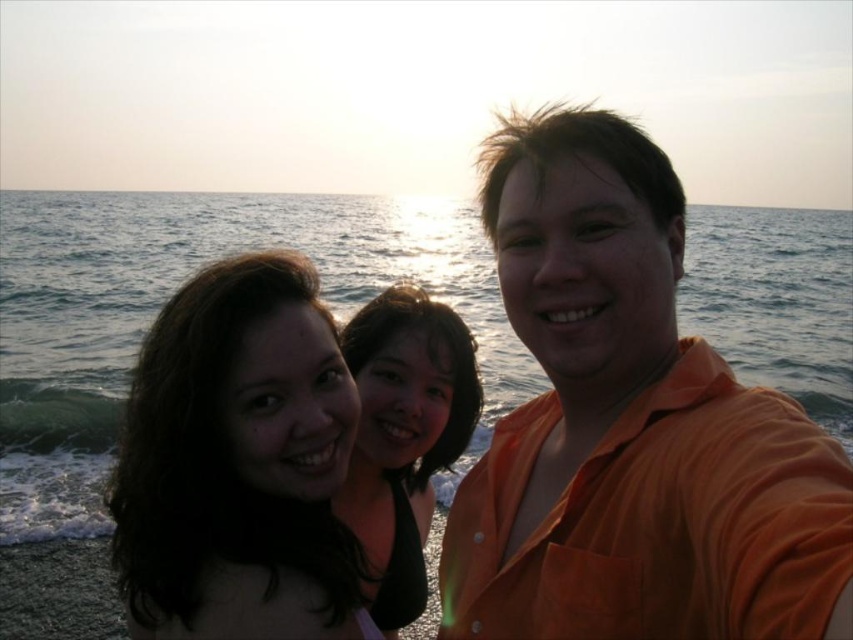
Does blue water at center have a smaller size compared to dark brown hair at center?

No.

Which of these two, blue water at center or dark brown hair at center, stands shorter?

dark brown hair at center

Is point (314, 205) positioned in front of point (250, 264)?

No, it is behind (250, 264).

Where is `blue water at center`? Image resolution: width=853 pixels, height=640 pixels. blue water at center is located at coordinates click(172, 291).

Can you confirm if orange cotton shirt at right is positioned to the left of black matte hair at center?

Incorrect, orange cotton shirt at right is not on the left side of black matte hair at center.

Who is positioned more to the right, orange cotton shirt at right or black matte hair at center?

orange cotton shirt at right is more to the right.

Is point (495, 465) farther from camera compared to point (430, 436)?

That is False.

Identify the location of orange cotton shirt at right. The height and width of the screenshot is (640, 853). (x=630, y=426).

Does orange cotton shirt at right have a lesser width compared to blue water at center?

Indeed, orange cotton shirt at right has a lesser width compared to blue water at center.

Which is more to the right, orange cotton shirt at right or blue water at center?

blue water at center

Is point (606, 582) farther from viewer compared to point (279, 244)?

No.

At what (x,y) coordinates should I click in order to perform the action: click on orange cotton shirt at right. Please return your answer as a coordinate pair (x, y). The width and height of the screenshot is (853, 640). Looking at the image, I should click on (630, 426).